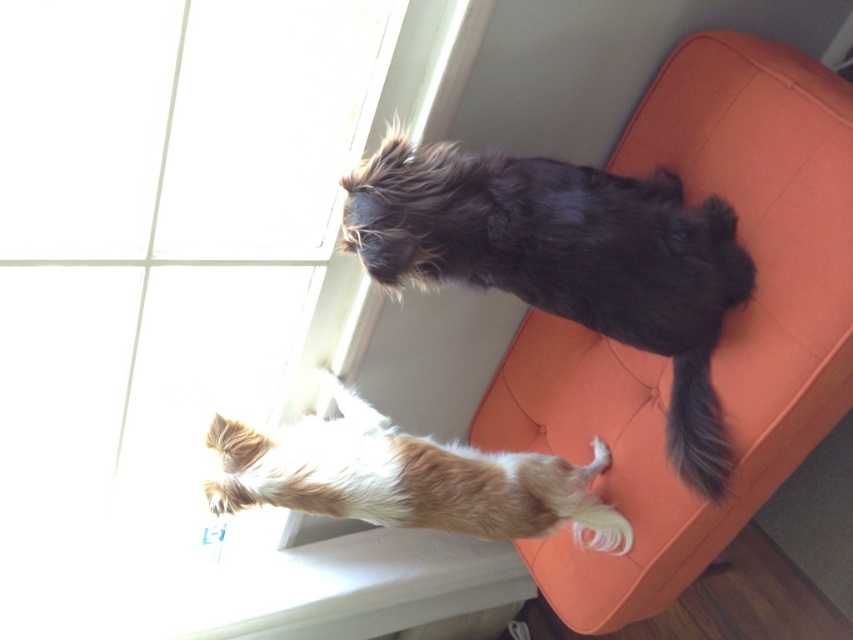
Which is behind, point (154, 161) or point (364, 413)?

Positioned behind is point (364, 413).

In the scene shown: Is transparent glass window at upper left smaller than brown fur dog at upper right?

Actually, transparent glass window at upper left might be larger than brown fur dog at upper right.

Between point (207, 364) and point (448, 484), which one is positioned behind?

Positioned behind is point (207, 364).

Where is `transparent glass window at upper left`? The height and width of the screenshot is (640, 853). transparent glass window at upper left is located at coordinates (171, 248).

Between transparent glass window at upper left and shaggy black dog at upper right, which one appears on the right side from the viewer's perspective?

Positioned to the right is shaggy black dog at upper right.

Is transparent glass window at upper left below shaggy black dog at upper right?

Correct, transparent glass window at upper left is located below shaggy black dog at upper right.

You are a GUI agent. You are given a task and a screenshot of the screen. Output one action in this format:
    pyautogui.click(x=<x>, y=<y>)
    Task: Click on the transparent glass window at upper left
    
    Given the screenshot: What is the action you would take?
    [171, 248]

Is shaggy black dog at upper right below blue silky tail at lower right?

Incorrect, shaggy black dog at upper right is not positioned below blue silky tail at lower right.

Who is positioned more to the left, shaggy black dog at upper right or blue silky tail at lower right?

Positioned to the left is shaggy black dog at upper right.

Is point (618, 208) more distant than point (701, 358)?

No, (618, 208) is in front of (701, 358).

Where is `shaggy black dog at upper right`? shaggy black dog at upper right is located at coordinates (566, 260).